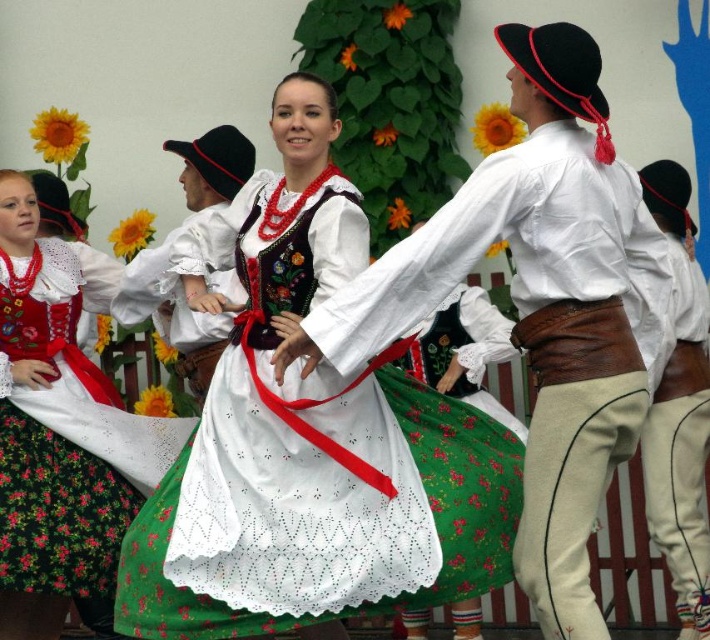
Which is above, white satin dress at center or green floral skirt at center?

white satin dress at center is above.

Does white satin dress at center have a greater width compared to green floral skirt at center?

Indeed, white satin dress at center has a greater width compared to green floral skirt at center.

What do you see at coordinates (295, 504) in the screenshot? The image size is (710, 640). I see `white satin dress at center` at bounding box center [295, 504].

Identify the location of white satin dress at center. The image size is (710, 640). (295, 504).

Between white satin dress at center and white lace dress at center, which one appears on the left side from the viewer's perspective?

white satin dress at center is more to the left.

This screenshot has height=640, width=710. What do you see at coordinates (295, 504) in the screenshot?
I see `white satin dress at center` at bounding box center [295, 504].

At what (x,y) coordinates should I click in order to perform the action: click on white satin dress at center. Please return your answer as a coordinate pair (x, y). Looking at the image, I should click on coord(295,504).

Can you confirm if white lace dress at center is positioned below green floral skirt at center?

No.

Can you confirm if white lace dress at center is bigger than green floral skirt at center?

Correct, white lace dress at center is larger in size than green floral skirt at center.

Does point (520, 209) come closer to viewer compared to point (45, 637)?

Yes, point (520, 209) is closer to viewer.

Image resolution: width=710 pixels, height=640 pixels. I want to click on white lace dress at center, so click(x=530, y=320).